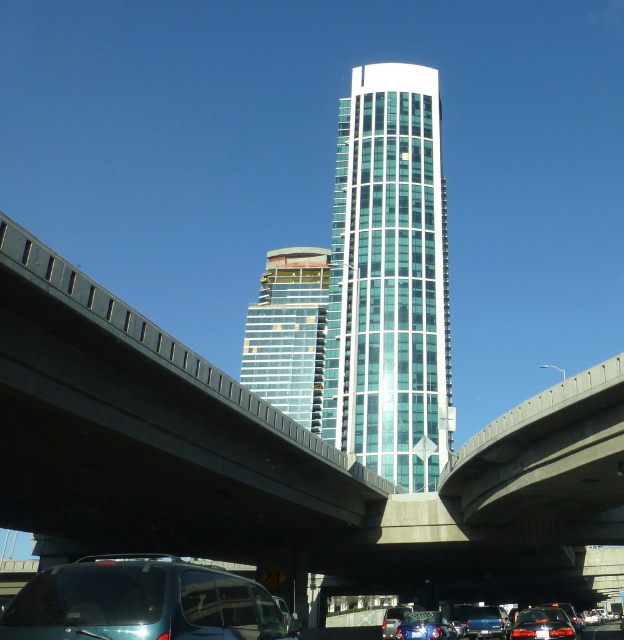
Between shiny black sedan at lower center and metallic silver sedan at lower center, which one is positioned lower?

metallic silver sedan at lower center is below.

From the picture: Is shiny black sedan at lower center smaller than metallic silver sedan at lower center?

No, shiny black sedan at lower center is not smaller than metallic silver sedan at lower center.

At what (x,y) coordinates should I click in order to perform the action: click on shiny black sedan at lower center. Please return your answer as a coordinate pair (x, y). Looking at the image, I should click on (542, 625).

Looking at this image, which of these two, shiny black sedan at lower center or shiny blue sedan at lower center, stands shorter?

With less height is shiny blue sedan at lower center.

Can you confirm if shiny black sedan at lower center is shorter than shiny blue sedan at lower center?

Incorrect, shiny black sedan at lower center's height does not fall short of shiny blue sedan at lower center's.

Measure the distance between shiny black sedan at lower center and camera.

A distance of 41.42 meters exists between shiny black sedan at lower center and camera.

Identify the location of shiny black sedan at lower center. (542, 625).

Is concrete bridge at center closer to camera compared to matte black sedan at lower center?

Yes, concrete bridge at center is closer to the viewer.

Does point (401, 554) come farther from viewer compared to point (480, 609)?

Yes, point (401, 554) is farther from viewer.

Between point (245, 502) and point (563, 616), which one is positioned behind?

Point (245, 502)

What are the coordinates of `concrete bridge at center` in the screenshot? It's located at (276, 460).